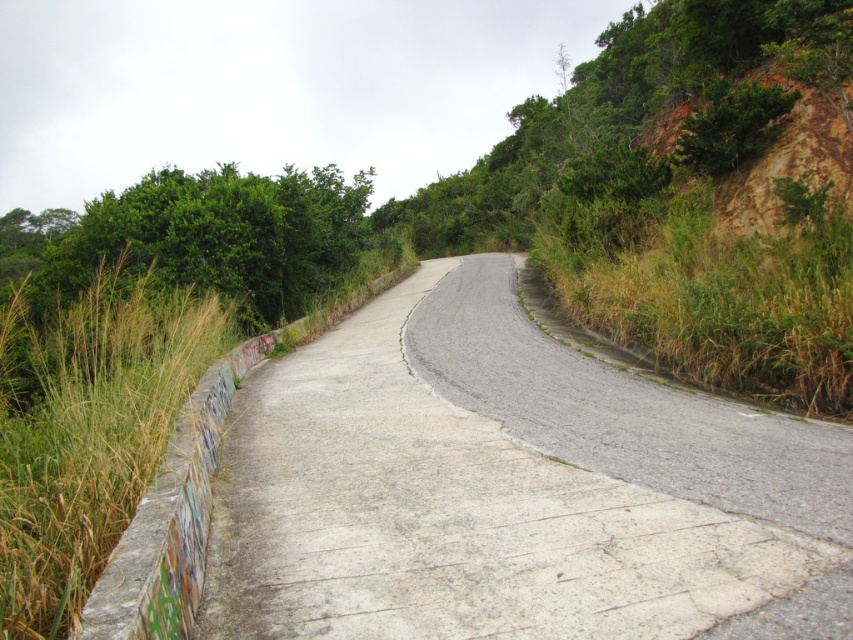
Question: Can you confirm if gray concrete road at center is bigger than dry grass at right?

Choices:
 (A) no
 (B) yes

Answer: (A)

Question: Which point is farther to the camera?

Choices:
 (A) gray concrete road at center
 (B) dry grass at right

Answer: (B)

Question: Is green grass at left to the left of dry grass at right from the viewer's perspective?

Choices:
 (A) yes
 (B) no

Answer: (A)

Question: Is gray concrete road at center bigger than dry grass at right?

Choices:
 (A) yes
 (B) no

Answer: (B)

Question: Which object is positioned farthest from the dry grass at right?

Choices:
 (A) gray concrete road at center
 (B) green grass at left

Answer: (B)

Question: Which of the following is the farthest from the observer?

Choices:
 (A) dry grass at right
 (B) gray concrete road at center
 (C) green grass at left

Answer: (A)